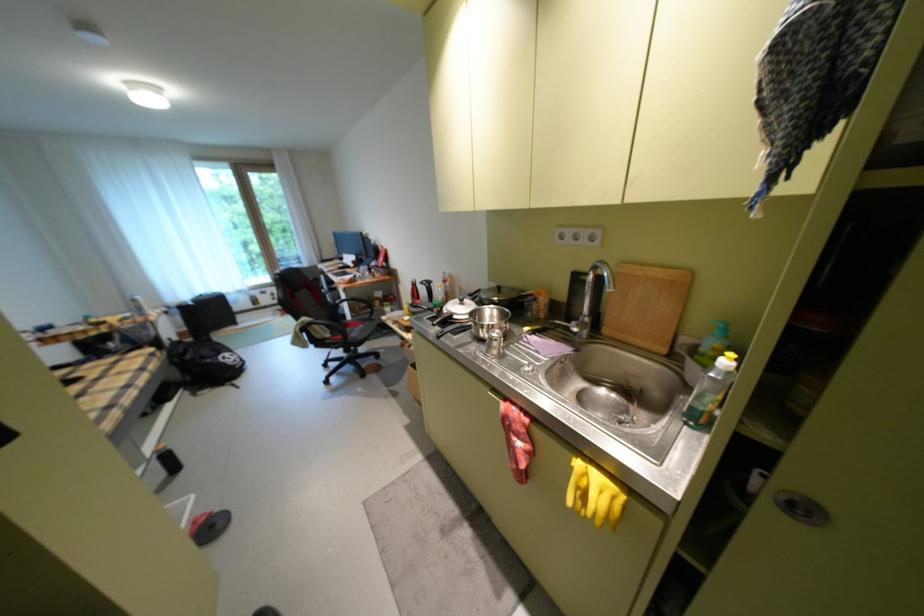
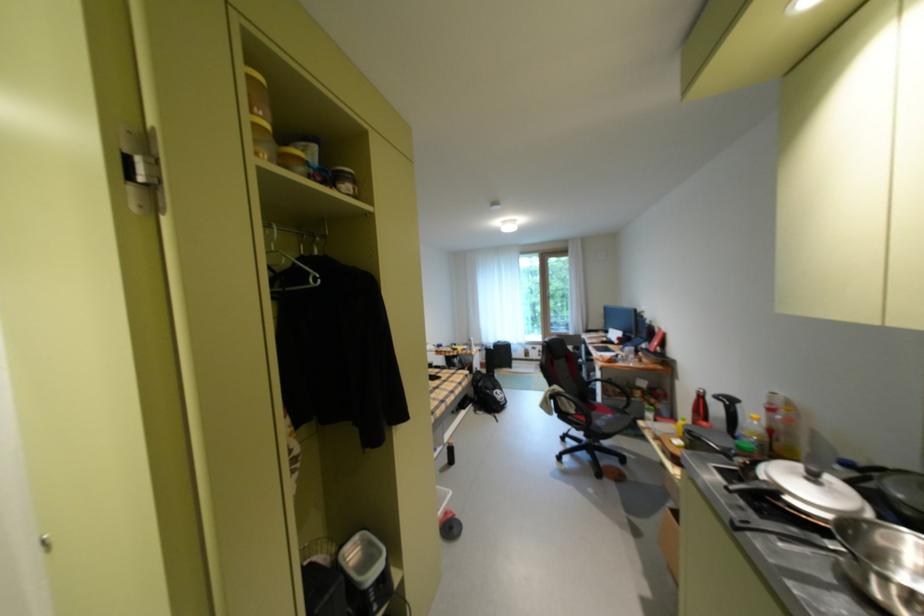
The point at (186,361) is marked in the first image. Where is the corresponding point in the second image?

(484, 384)